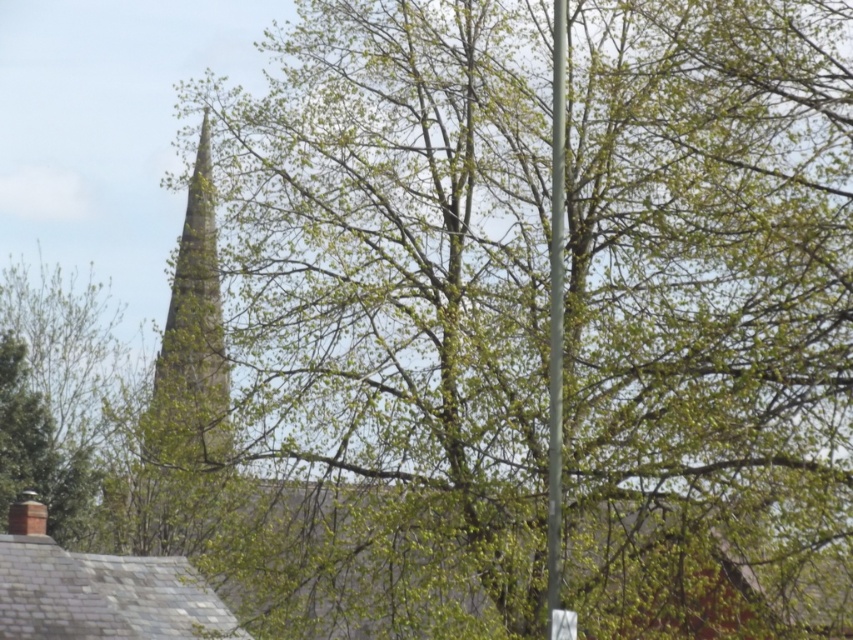
Question: Which object is the closest to the metallic gray pole at center?

Choices:
 (A) smooth gray steeple at center-left
 (B) green leafy tree at lower left
 (C) white plastic sign at lower center

Answer: (C)

Question: In this image, where is smooth gray steeple at center-left located relative to metallic gray pole at center?

Choices:
 (A) right
 (B) left

Answer: (B)

Question: Observing the image, what is the correct spatial positioning of green leafy tree at lower left in reference to smooth gray steeple at center-left?

Choices:
 (A) below
 (B) above

Answer: (A)

Question: Is the position of green leafy tree at lower left more distant than that of white plastic sign at lower center?

Choices:
 (A) no
 (B) yes

Answer: (B)

Question: Which point is closer to the camera?

Choices:
 (A) white plastic sign at lower center
 (B) metallic gray pole at center

Answer: (A)

Question: Which point is farther from the camera taking this photo?

Choices:
 (A) tap(55, 326)
 (B) tap(558, 612)
 (C) tap(222, 436)
 (D) tap(555, 579)

Answer: (A)